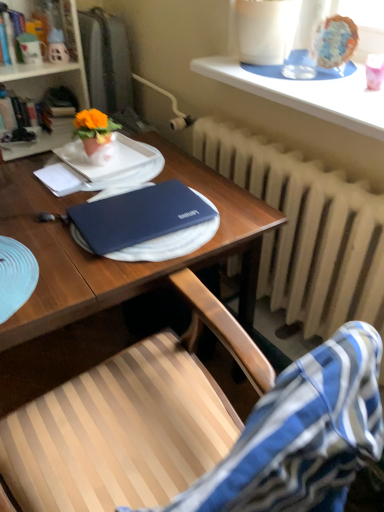
Identify the location of free space above matte blue laptop at center (from a real-world perspective). (132, 193).